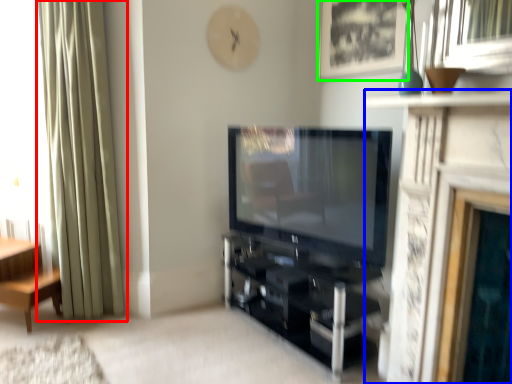
Question: Which is nearer to the curtain (highlighted by a red box)? fireplace (highlighted by a blue box) or picture frame (highlighted by a green box).

Choices:
 (A) fireplace
 (B) picture frame

Answer: (B)